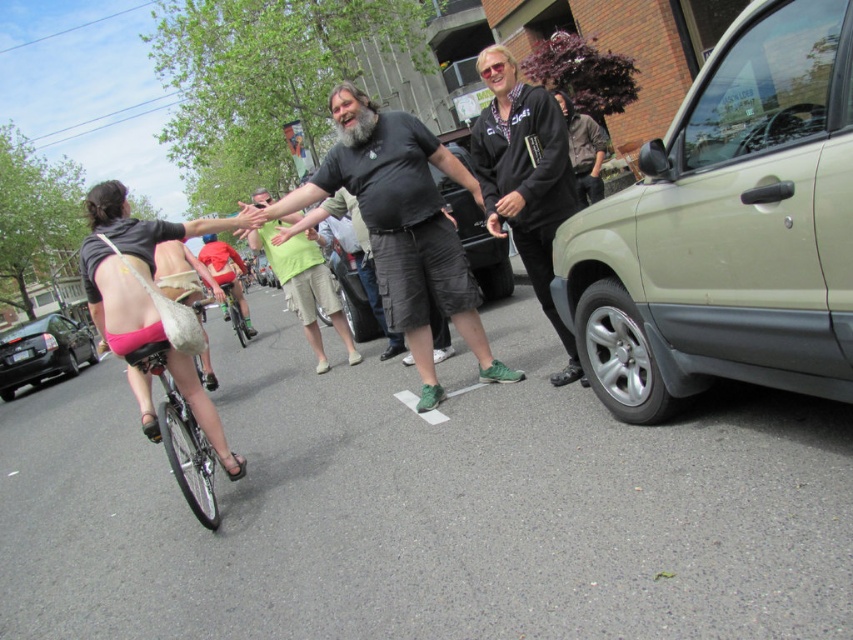
You are a pedestrian trying to cross the street safely. You see the green matte shorts at center and the black glossy car at left. Which object is narrower, and would it be safer to walk around it?

The green matte shorts at center is thinner than the black glossy car at left, so it would be safer to walk around the green matte shorts at center since it is narrower.